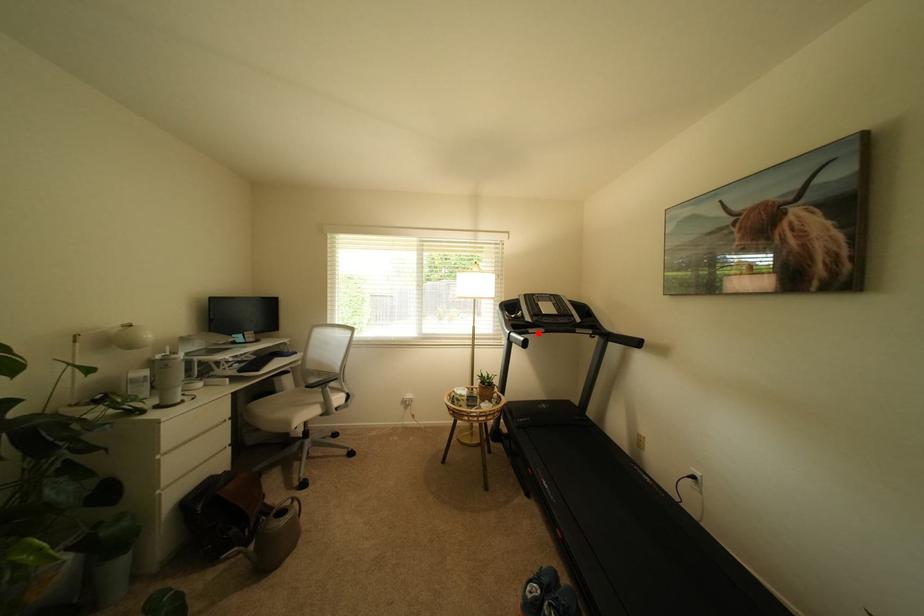
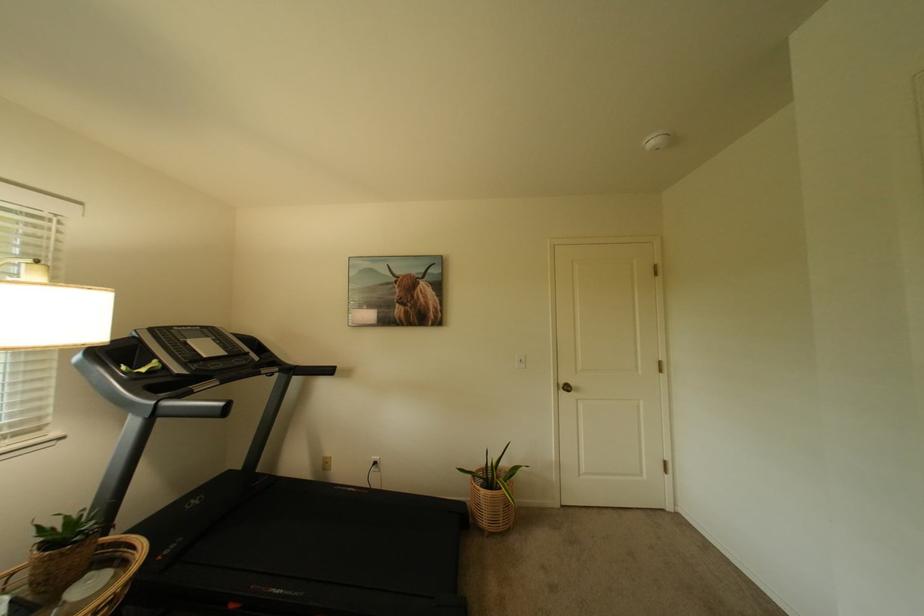
The point at the highlighted location is marked in the first image. Where is the corresponding point in the second image?

(203, 392)